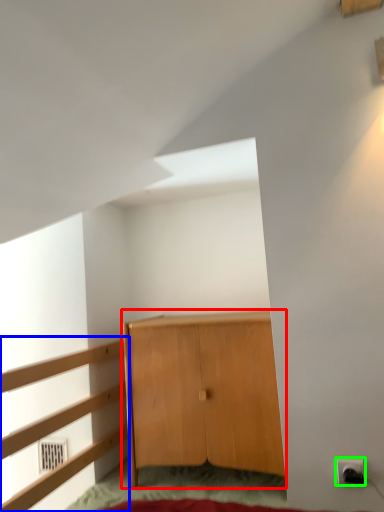
Question: Estimate the real-world distances between objects in this image. Which object is closer to cupboard (highlighted by a red box), dresser (highlighted by a blue box) or electric outlet (highlighted by a green box)?

Choices:
 (A) dresser
 (B) electric outlet

Answer: (A)